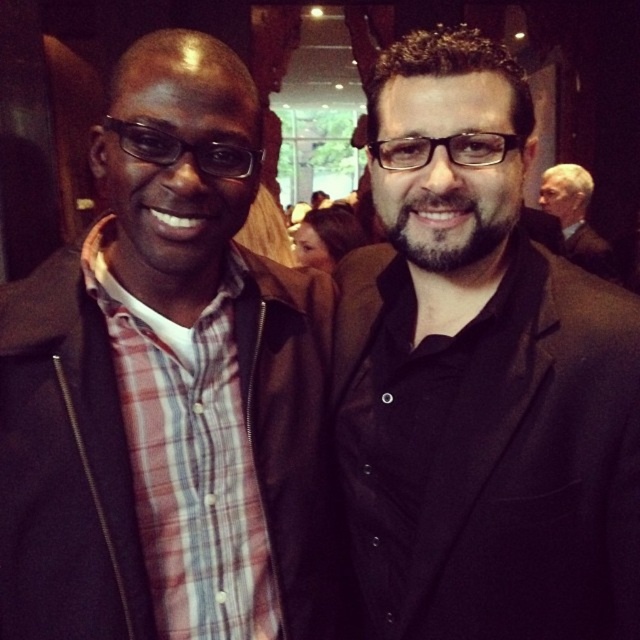
You are at a networking event and need to grab a drink from the refreshments area. There is a gray suit at upper right and transparent plastic glasses at center in your line of sight. Which object should you look up to see?

The gray suit at upper right is above the transparent plastic glasses at center, so you should look up to see the gray suit at upper right.

You are at a social event and want to take a photo of the black matte suit at center and the transparent plastic glasses at center. Since you can only focus on one object at a time, which one should you aim your camera at first to ensure the other is still in frame?

You should aim your camera at the transparent plastic glasses at center first because the black matte suit at center is to the right of it, ensuring both remain in the frame when centered on the glasses.